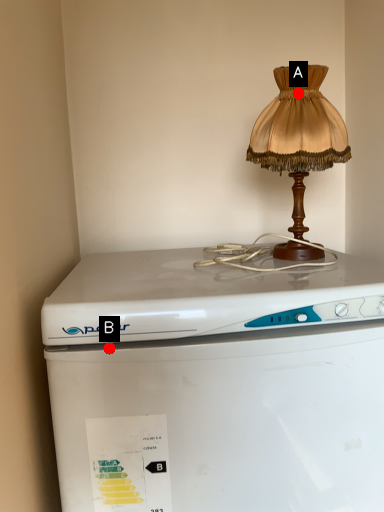
Question: Two points are circled on the image, labeled by A and B beside each circle. Which point appears farthest from the camera in this image?

Choices:
 (A) A is further
 (B) B is further

Answer: (A)